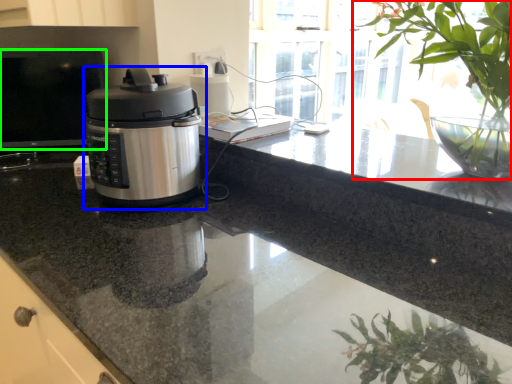
Question: Which object is positioned farthest from houseplant (highlighted by a red box)? Select from home appliance (highlighted by a blue box) and desktop (highlighted by a green box).

Choices:
 (A) home appliance
 (B) desktop

Answer: (B)